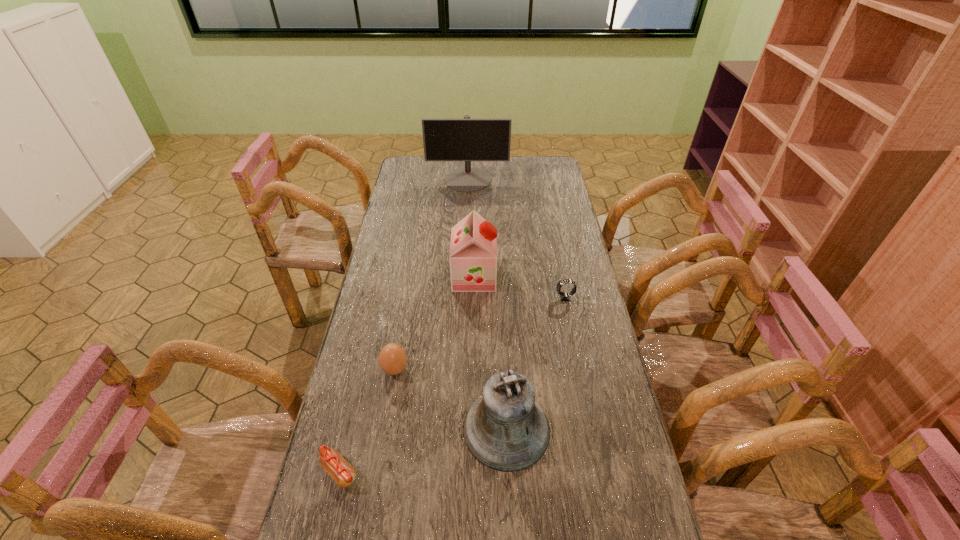
In order to click on vacant space situated 0.050m with the cap open on the soya milk in this screenshot , I will do `click(510, 276)`.

Find the location of a particular element. This screenshot has width=960, height=540. vacant region located 0.210m on the right of the bell is located at coordinates (630, 429).

Find the location of a particular element. This screenshot has width=960, height=540. vacant space situated 0.170m on the back of the fourth tallest object is located at coordinates point(404,316).

Identify the location of vacant space located 0.170m on the face of the fifth tallest object. (506, 298).

Where is `free region located 0.080m on the face of the fifth tallest object`? free region located 0.080m on the face of the fifth tallest object is located at coordinates (532, 298).

Find the location of `vacant space located on the face of the fifth tallest object`. vacant space located on the face of the fifth tallest object is located at coordinates (526, 298).

The width and height of the screenshot is (960, 540). I want to click on vacant area situated 0.070m on the front of the shortest object, so click(327, 524).

Locate an element on the screen. Image resolution: width=960 pixels, height=540 pixels. object that is at the far edge is located at coordinates (466, 139).

Where is `computer monitor that is at the left edge`? This screenshot has height=540, width=960. computer monitor that is at the left edge is located at coordinates (466, 139).

Where is `boiled egg located in the left edge section of the desktop`? The width and height of the screenshot is (960, 540). boiled egg located in the left edge section of the desktop is located at coordinates (392, 359).